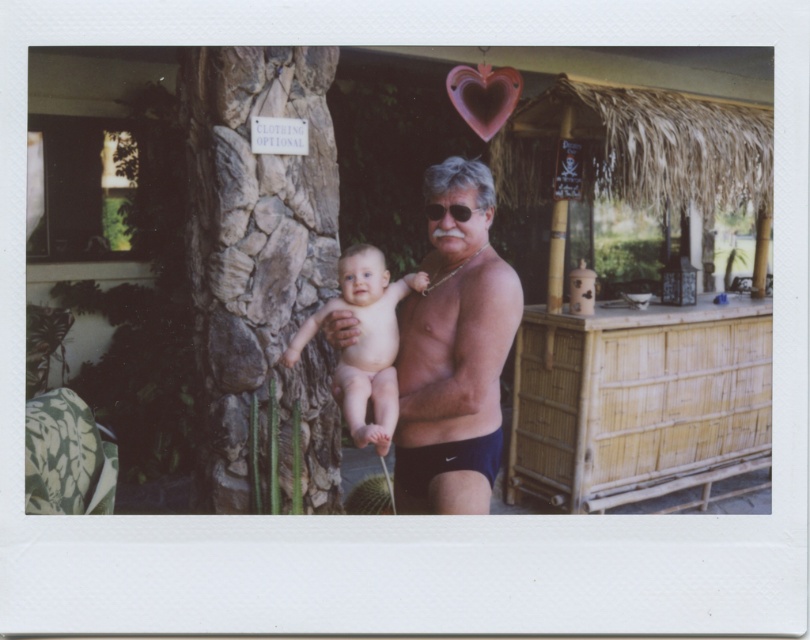
Based on the photo, you are a photographer trying to capture a candid shot of the bamboo hut at center and the shiny black shorts at center. Since you want to ensure both are in focus, which object should you focus on first to account for their sizes?

The bamboo hut at center is larger than the shiny black shorts at center, so you should focus on the bamboo hut at center first to ensure both are in focus.

You are a photographer standing at the position of the camera in the image. You want to ensure the smooth skin baby at center is in focus while also capturing the brown rough stone tree trunk at left in the background. Given that your camera has a depth of field range of 25 inches, will both subjects be in focus?

The brown rough stone tree trunk at left is 31.42 inches away from the smooth skin baby at center. Since the depth of field range is 25 inches, which is less than the distance between them, the baby and the tree trunk cannot both be in focus at the same time.